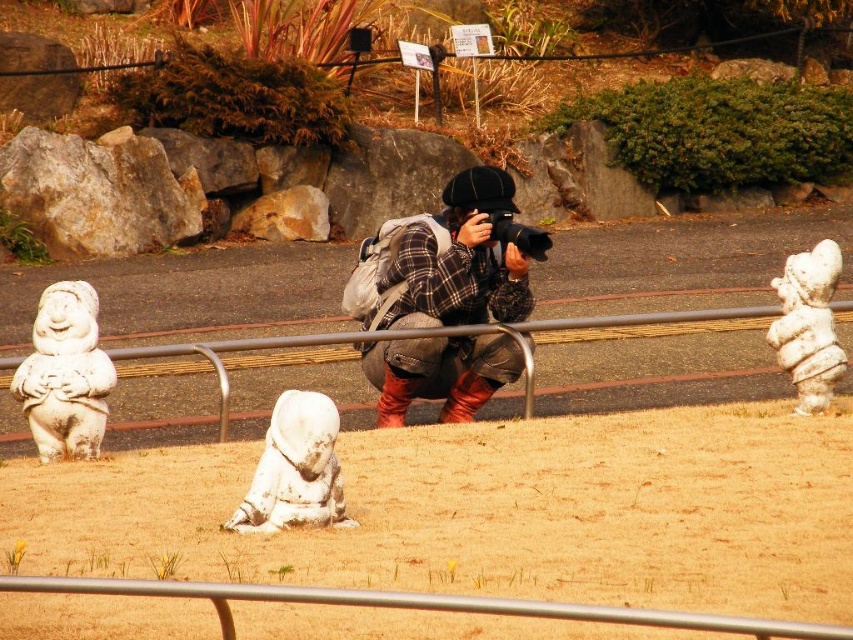
You are standing in the park and see the plaid fabric camera at center. Where is it located in the image?

The plaid fabric camera at center is located at point (450, 260).

You are standing in the park and want to take a photo of both the statue at point (393, 248) and the statue at point (693, 316). Which statue is closer to you so that you can focus on it first?

The statue at point (393, 248) is closer to you, so you can focus on it first because it is further to the viewer than the statue at point (693, 316).

You are standing in the park and want to take a photo of the statues. You notice a point at coordinates point (479, 310) that is 9.49 meters away from you. If you move 3 meters closer to this point, how far will you be from it?

If you move 3 meters closer to the point (479, 310), your new distance will be 9.49 meters minus 3 meters, which equals 6.49 meters.